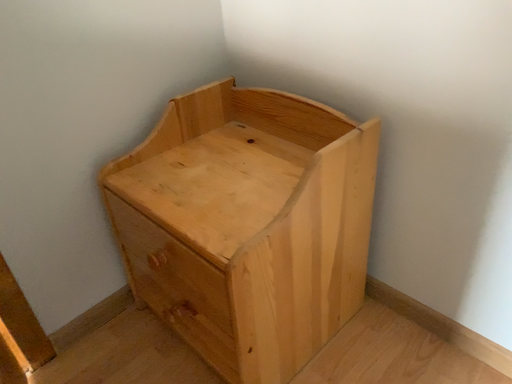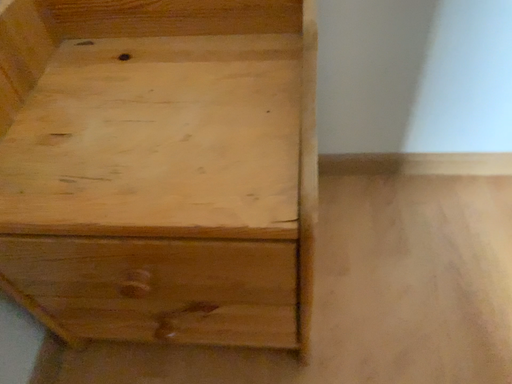
Question: Which way did the camera rotate in the video?

Choices:
 (A) rotated upward
 (B) rotated downward

Answer: (B)